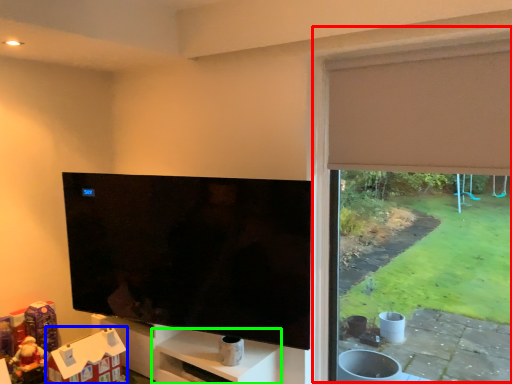
Question: Which object is the closest to the window frame (highlighted by a red box)? Choose among these: toy (highlighted by a blue box) or shelf (highlighted by a green box).

Choices:
 (A) toy
 (B) shelf

Answer: (B)